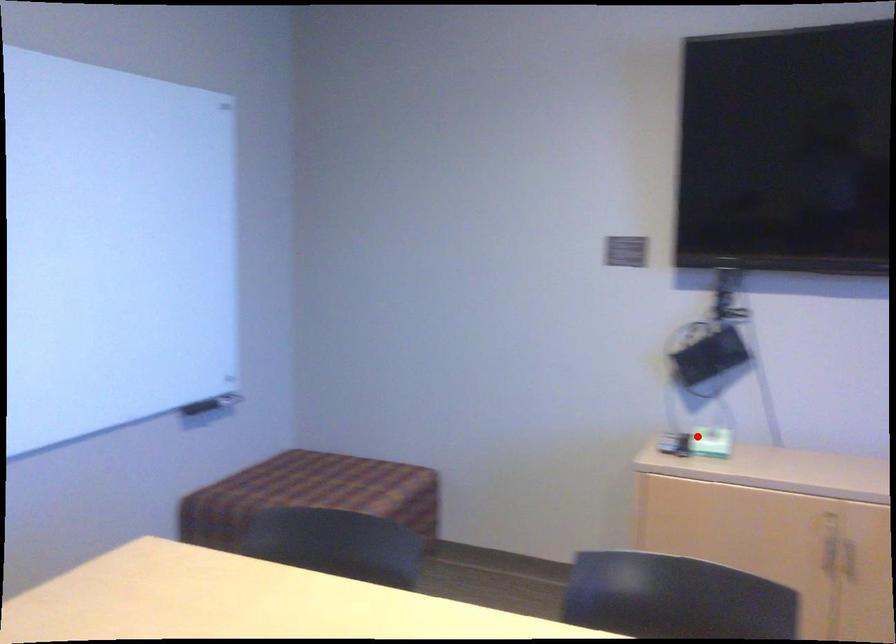
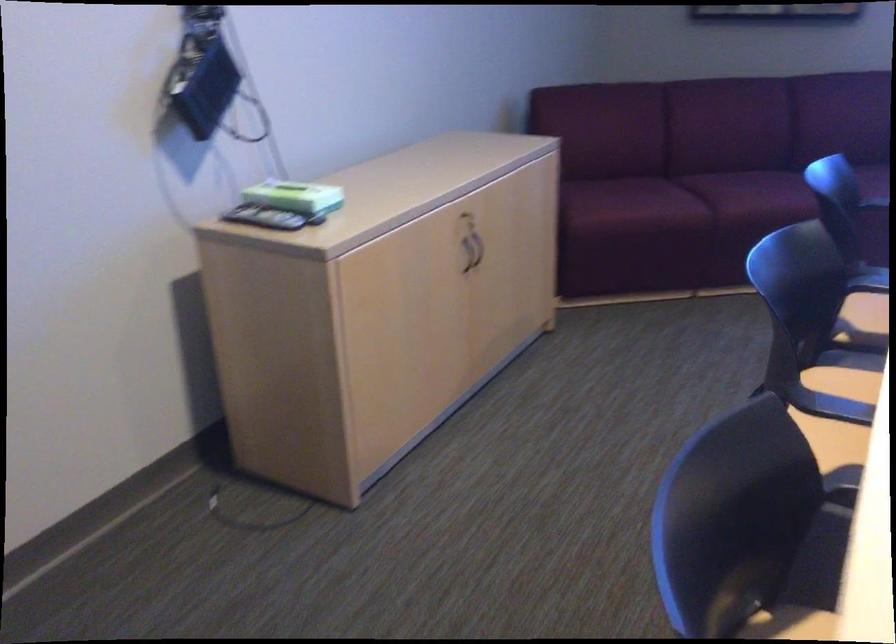
Question: I am providing you with two images of the same scene from different viewpoints. Given a red point in image1, look at the same physical point in image2. Is it:

Choices:
 (A) Closer to the viewpoint
 (B) Farther from the viewpoint

Answer: (A)